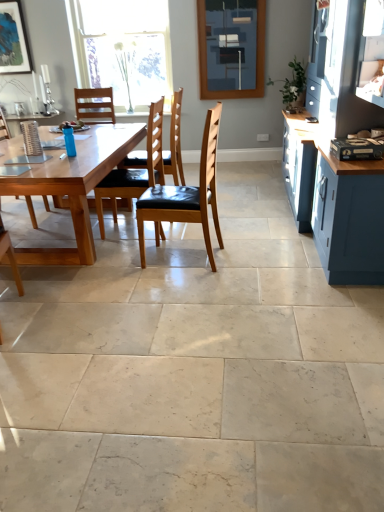
Identify the location of blank space to the left of matte blue cabinet at right. (211, 231).